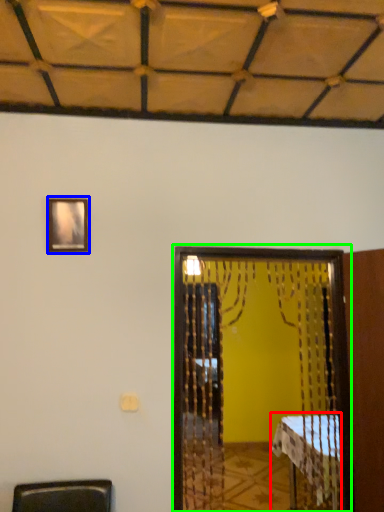
Question: Based on their relative distances, which object is nearer to table (highlighted by a red box)? Choose from picture frame (highlighted by a blue box) and screen door (highlighted by a green box).

Choices:
 (A) picture frame
 (B) screen door

Answer: (B)